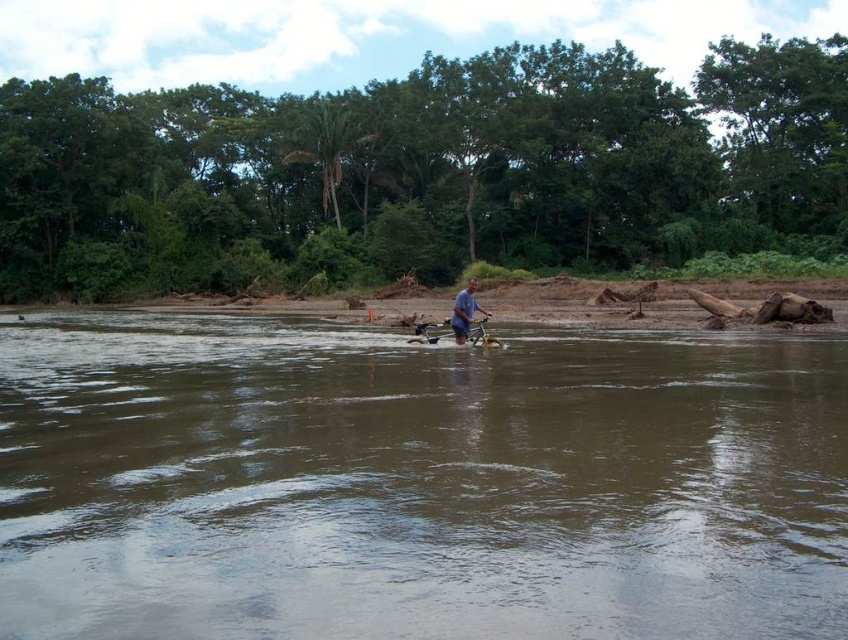
Question: Does brown muddy water at center have a lesser width compared to blue fabric shirt at center?

Choices:
 (A) no
 (B) yes

Answer: (A)

Question: Which point is closer to the camera taking this photo?

Choices:
 (A) (464, 333)
 (B) (349, 561)

Answer: (B)

Question: Which point is farther to the camera?

Choices:
 (A) brown muddy water at center
 (B) blue fabric shirt at center

Answer: (B)

Question: Which point is closer to the camera?

Choices:
 (A) blue fabric shirt at center
 (B) brown muddy water at center

Answer: (B)

Question: Can you confirm if brown muddy water at center is positioned below blue fabric shirt at center?

Choices:
 (A) yes
 (B) no

Answer: (A)

Question: Is brown muddy water at center thinner than blue fabric shirt at center?

Choices:
 (A) yes
 (B) no

Answer: (B)